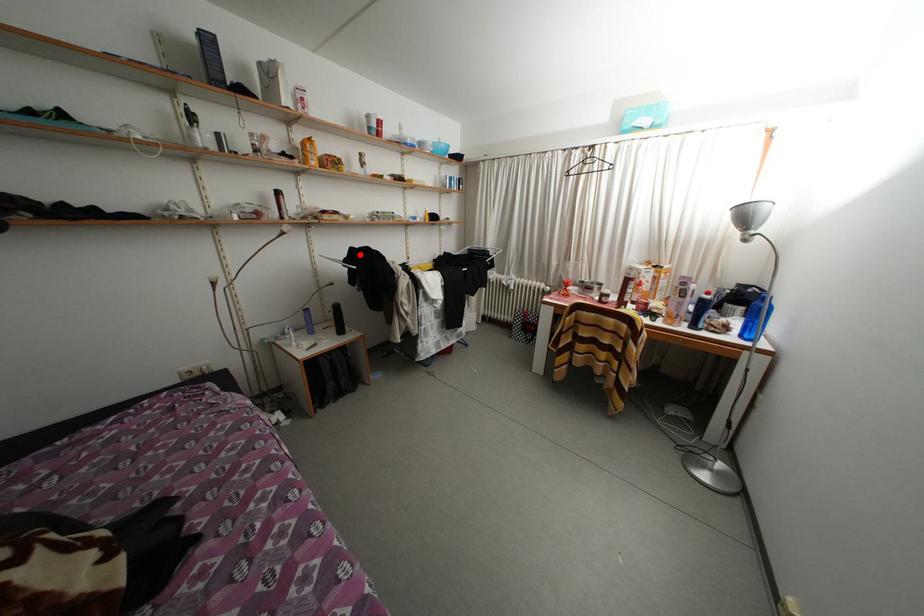
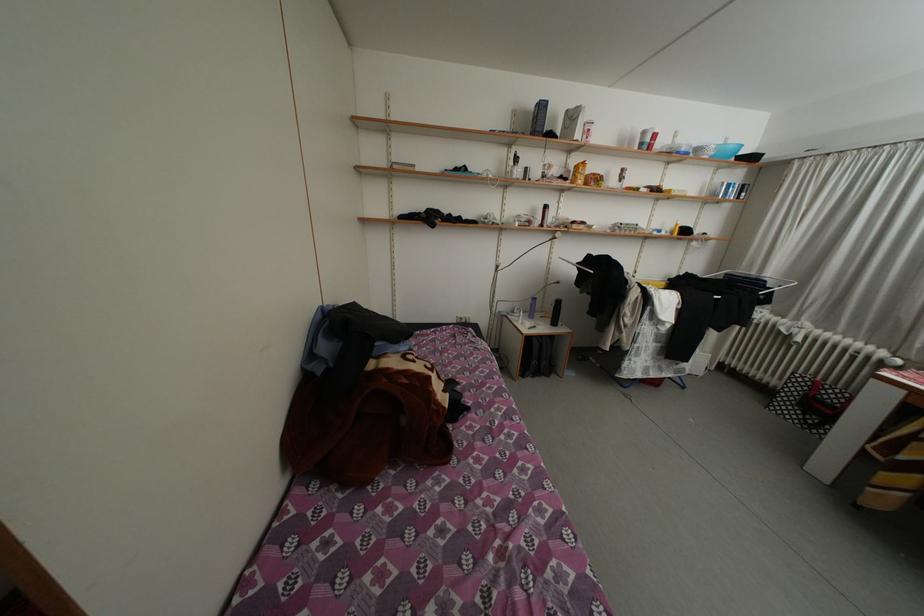
Locate, in the second image, the point that corresponds to the highlighted location in the first image.

(597, 262)